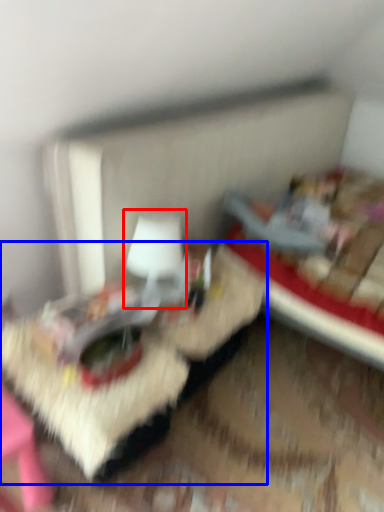
Question: Which object appears closest to the camera in this image, table lamp (highlighted by a red box) or table (highlighted by a blue box)?

Choices:
 (A) table lamp
 (B) table

Answer: (B)